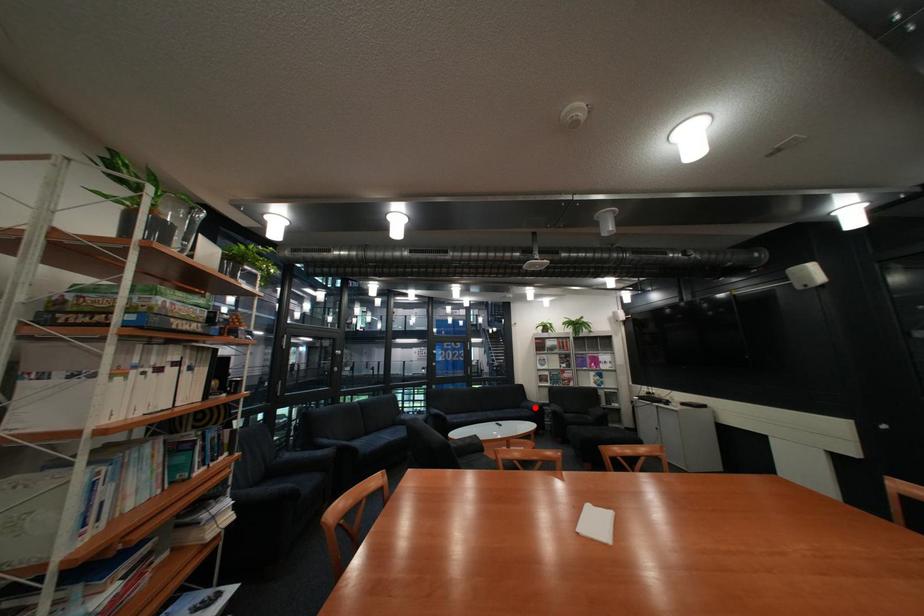
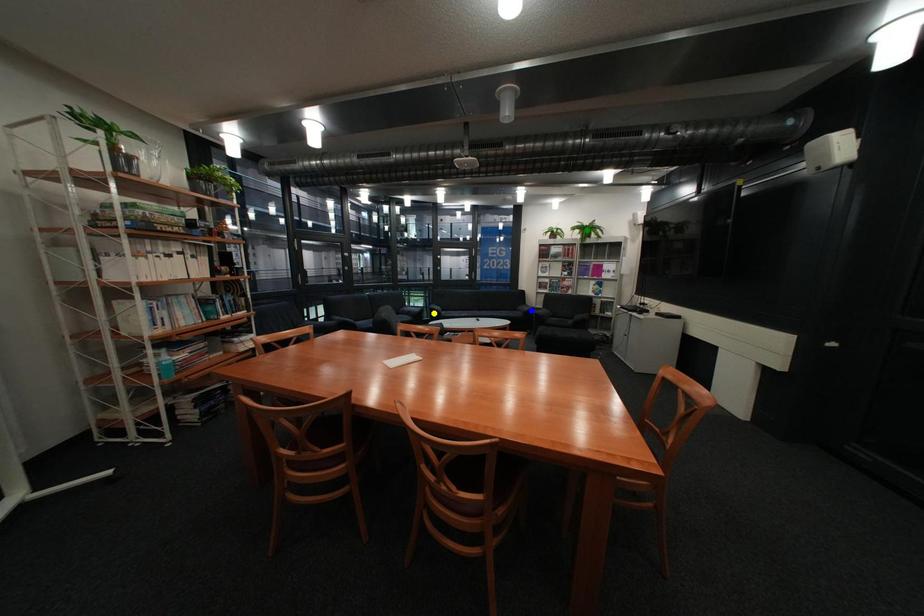
Question: I am providing you with two images of the same scene from different viewpoints. A red point is marked on the first image. You are given multiple points on the second image. Can you choose the point in image 2 that corresponds to the point in image 1?

Choices:
 (A) green point
 (B) yellow point
 (C) blue point

Answer: (C)